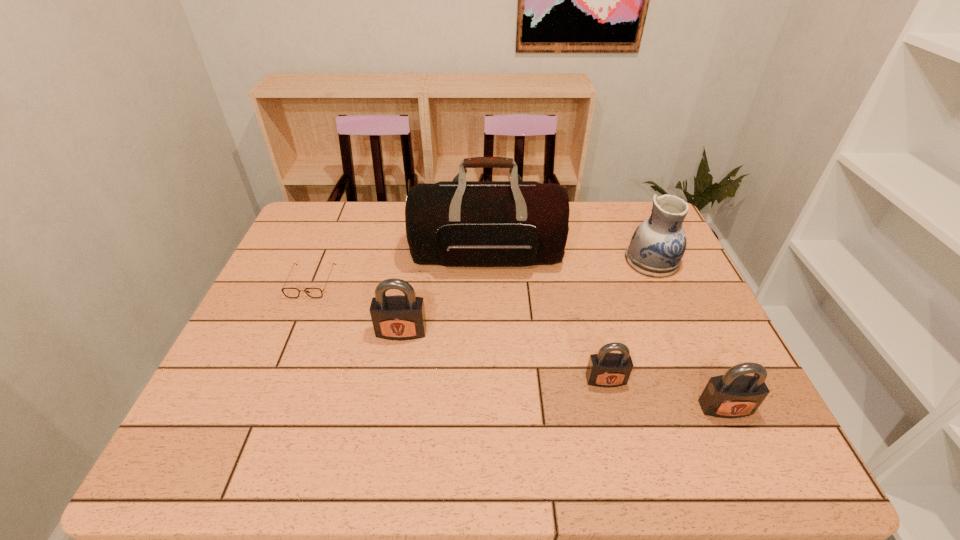
You are a GUI agent. You are given a task and a screenshot of the screen. Output one action in this format:
    pyautogui.click(x=<x>, y=<y>)
    Task: Click on the object positioned at the near right corner
    This screenshot has height=540, width=960.
    Given the screenshot: What is the action you would take?
    tap(733, 395)

The height and width of the screenshot is (540, 960). I want to click on free space at the far edge, so click(383, 229).

Identify the location of blank space at the near edge of the desktop. (495, 416).

Where is `free location at the left edge`? This screenshot has height=540, width=960. free location at the left edge is located at coordinates (305, 271).

You are a GUI agent. You are given a task and a screenshot of the screen. Output one action in this format:
    pyautogui.click(x=<x>, y=<y>)
    Task: Click on the blank space at the right edge of the desktop
    
    Given the screenshot: What is the action you would take?
    pyautogui.click(x=704, y=335)

You are a GUI agent. You are given a task and a screenshot of the screen. Output one action in this format:
    pyautogui.click(x=<x>, y=<y>)
    Task: Click on the vacant region at the far left corner of the desktop
    The height and width of the screenshot is (540, 960).
    Given the screenshot: What is the action you would take?
    pyautogui.click(x=310, y=215)

In the image, there is a desktop. Where is `vacant space at the near left corner`? vacant space at the near left corner is located at coordinates (214, 390).

At what (x,y) coordinates should I click in order to perform the action: click on vacant space at the near right corner of the desktop. Please return your answer as a coordinate pair (x, y). The image size is (960, 540). Looking at the image, I should click on (691, 408).

The width and height of the screenshot is (960, 540). In order to click on vacant area that lies between the second tallest object and the duffel bag in this screenshot , I will do tap(569, 258).

I want to click on unoccupied area between the leftmost padlock and the shortest object, so click(x=356, y=307).